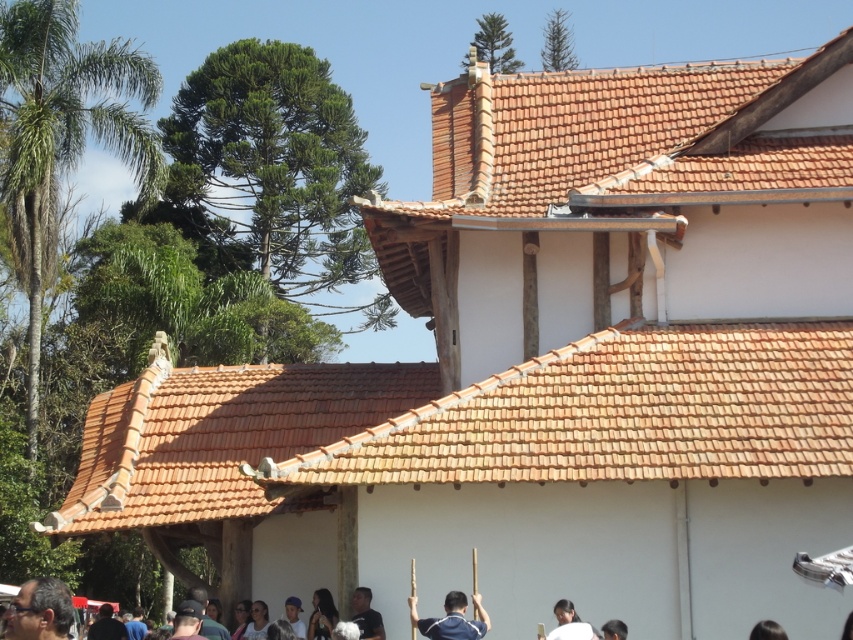
Can you confirm if dark brown hair at lower left is bigger than dark blue shirt at center?

Yes.

Measure the distance between dark brown hair at lower left and dark blue shirt at center.

dark brown hair at lower left and dark blue shirt at center are 29.07 feet apart from each other.

Locate an element on the screen. This screenshot has width=853, height=640. dark brown hair at lower left is located at coordinates (39, 611).

Is point (360, 637) more distant than point (613, 632)?

Yes.

Is dark blue shirt at center further to the viewer compared to dark brown hair at lower right?

That is True.

Locate an element on the screen. This screenshot has height=640, width=853. dark blue shirt at center is located at coordinates (366, 616).

Who is positioned more to the right, dark brown hair at lower left or blue fabric shirt at center?

blue fabric shirt at center

Does dark brown hair at lower left have a lesser width compared to blue fabric shirt at center?

Yes.

Between point (16, 612) and point (416, 618), which one is positioned behind?

Point (416, 618)

Where is `dark brown hair at lower left`? dark brown hair at lower left is located at coordinates (39, 611).